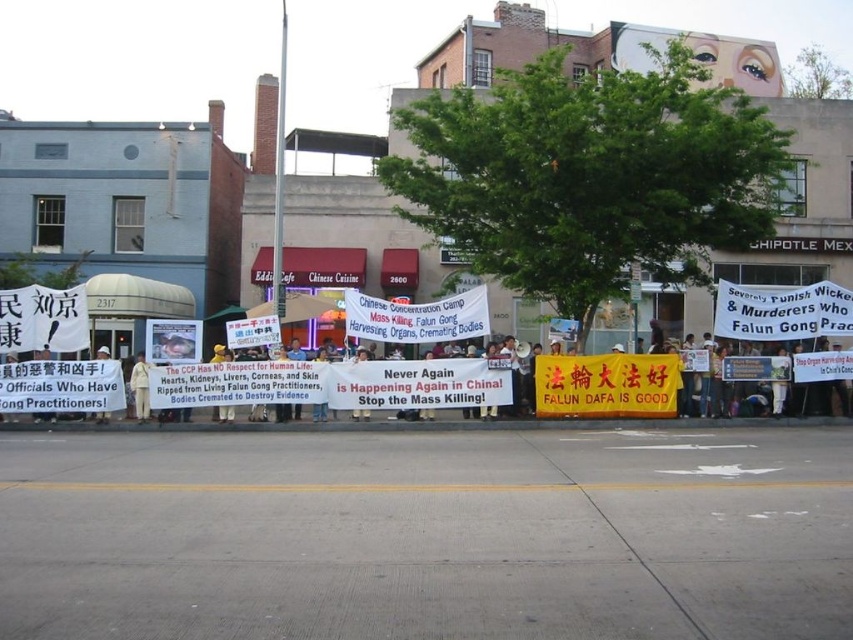
Question: Does light beige cotton shirt at center have a smaller size compared to white paper sign at center?

Choices:
 (A) no
 (B) yes

Answer: (B)

Question: Can you confirm if light beige cotton shirt at center is smaller than white paper sign at center?

Choices:
 (A) yes
 (B) no

Answer: (A)

Question: Can you confirm if light beige cotton shirt at center is thinner than white paper sign at center?

Choices:
 (A) yes
 (B) no

Answer: (A)